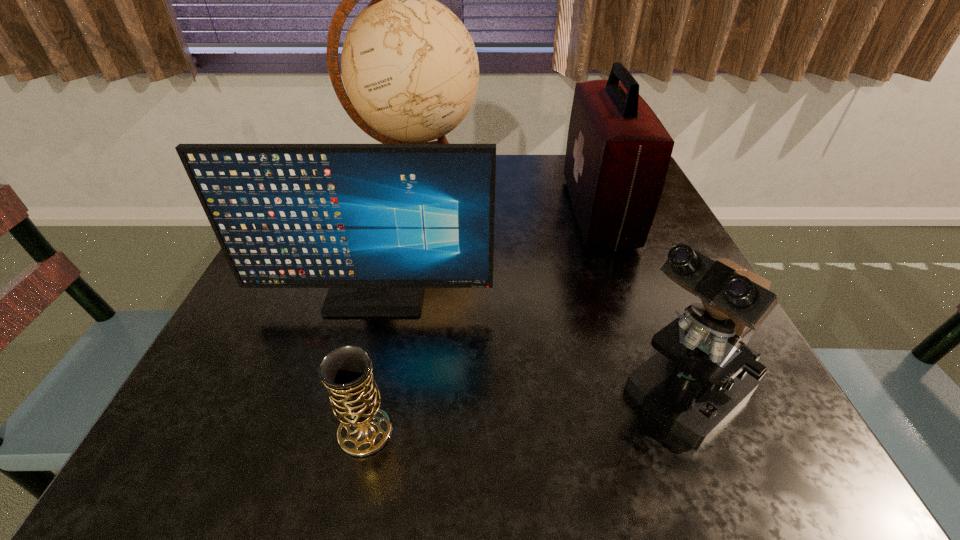
Identify the location of globe. (410, 68).

Where is `the first aid kit`? the first aid kit is located at coordinates (618, 152).

Locate an element on the screen. Image resolution: width=960 pixels, height=540 pixels. computer monitor is located at coordinates (375, 223).

Locate an element on the screen. The height and width of the screenshot is (540, 960). microscope is located at coordinates (704, 370).

This screenshot has height=540, width=960. Find the location of `chalice`. chalice is located at coordinates (346, 371).

Locate an element on the screen. This screenshot has width=960, height=540. free space located on the surface of the tallest object is located at coordinates (545, 191).

The height and width of the screenshot is (540, 960). Find the location of `free region located 0.140m on the side of the first aid kit with the cross symbol`. free region located 0.140m on the side of the first aid kit with the cross symbol is located at coordinates (508, 212).

Find the location of a particular element. Image resolution: width=960 pixels, height=540 pixels. free space located 0.310m on the side of the first aid kit with the cross symbol is located at coordinates (432, 212).

Find the location of a particular element. vacant space situated 0.210m on the side of the first aid kit with the cross symbol is located at coordinates (476, 212).

At what (x,y) coordinates should I click in order to perform the action: click on free space located 0.210m on the screen side of the computer monitor. Please return your answer as a coordinate pair (x, y). Looking at the image, I should click on (340, 430).